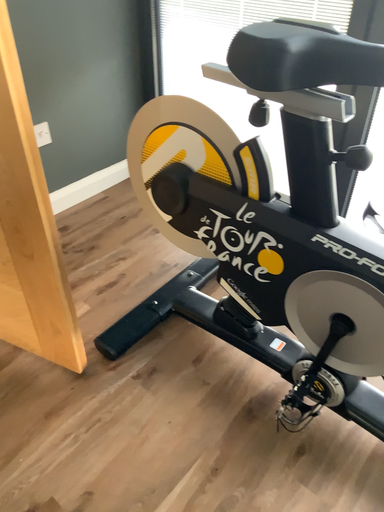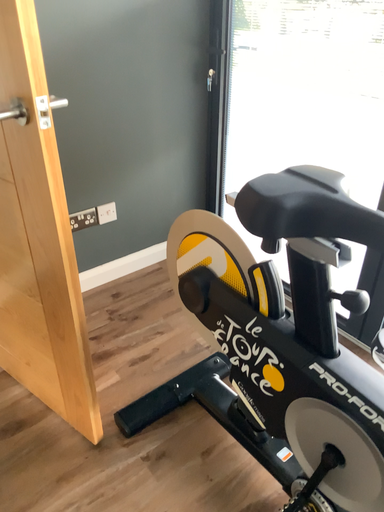
Question: How did the camera likely rotate when shooting the video?

Choices:
 (A) rotated left
 (B) rotated right

Answer: (A)